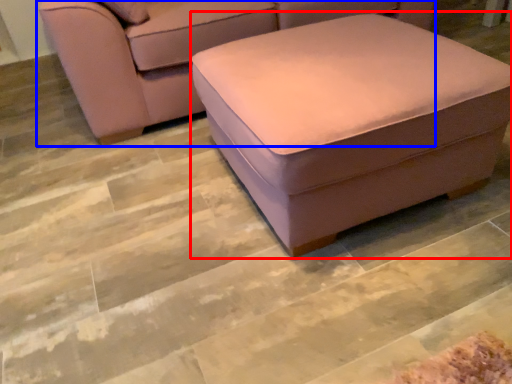
Question: Among these objects, which one is nearest to the camera, stool (highlighted by a red box) or studio couch (highlighted by a blue box)?

Choices:
 (A) stool
 (B) studio couch

Answer: (A)